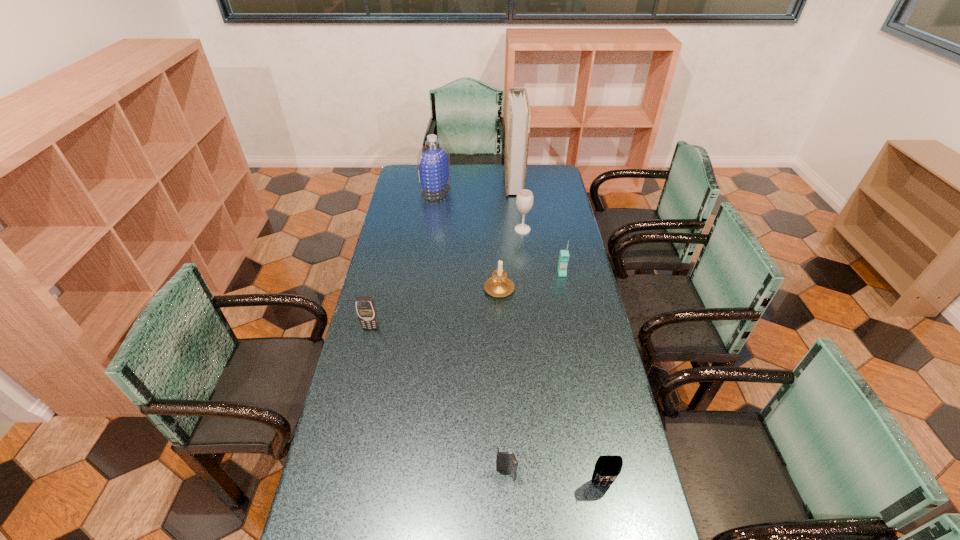
Where is `phonebook`? phonebook is located at coordinates (518, 114).

At what (x,y) coordinates should I click in order to perform the action: click on the seventh object from right to left. Please return your answer as a coordinate pair (x, y). The height and width of the screenshot is (540, 960). Looking at the image, I should click on (433, 161).

Where is `the seventh shortest object`? the seventh shortest object is located at coordinates (433, 161).

Where is `wineglass`? wineglass is located at coordinates (524, 201).

Where is `the sixth nearest object`? This screenshot has height=540, width=960. the sixth nearest object is located at coordinates (524, 201).

Where is `the farthest cellular telephone`? This screenshot has width=960, height=540. the farthest cellular telephone is located at coordinates (564, 254).

Where is `the sixth farthest object`? This screenshot has height=540, width=960. the sixth farthest object is located at coordinates (365, 306).

Where is `the third nearest cellular telephone`? The image size is (960, 540). the third nearest cellular telephone is located at coordinates (365, 306).

This screenshot has height=540, width=960. In order to click on candle holder in this screenshot , I will do `click(499, 285)`.

In order to click on the shortest cellular telephone in this screenshot , I will do `click(504, 461)`.